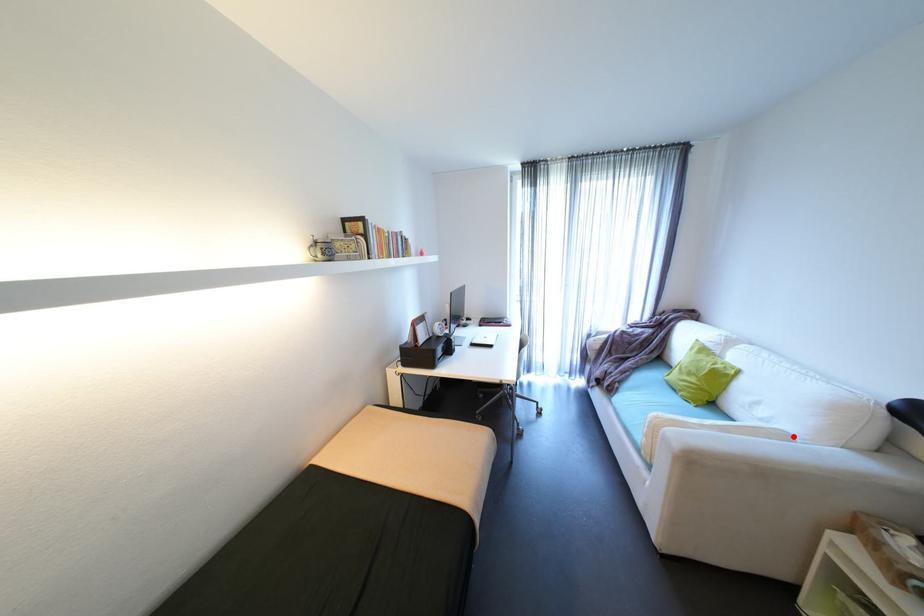
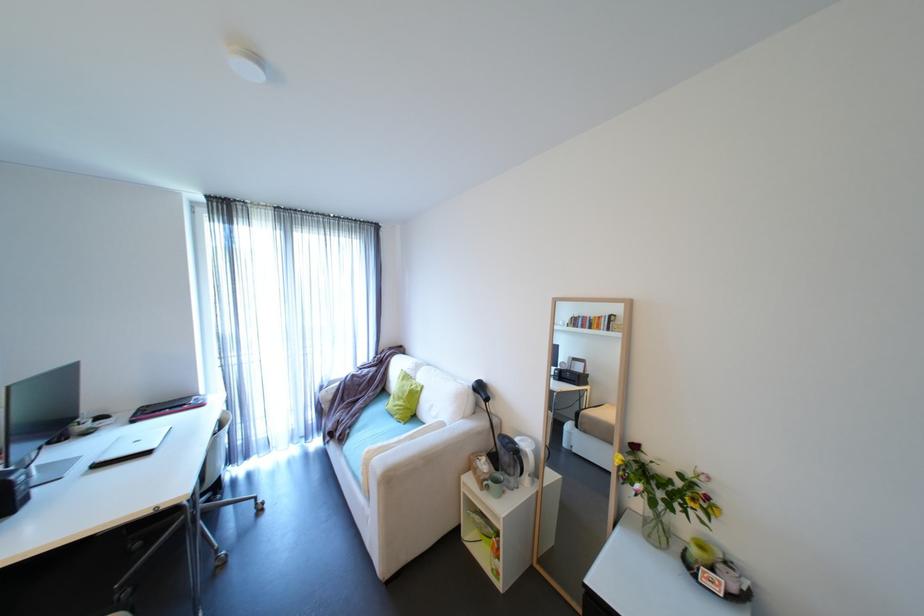
Question: I am providing you with two images of the same scene from different viewpoints. Image1 has a red point marked. In image2, the corresponding 3D location appears at what relative position? Reply with the corresponding letter.

Choices:
 (A) Closer
 (B) Farther

Answer: (B)